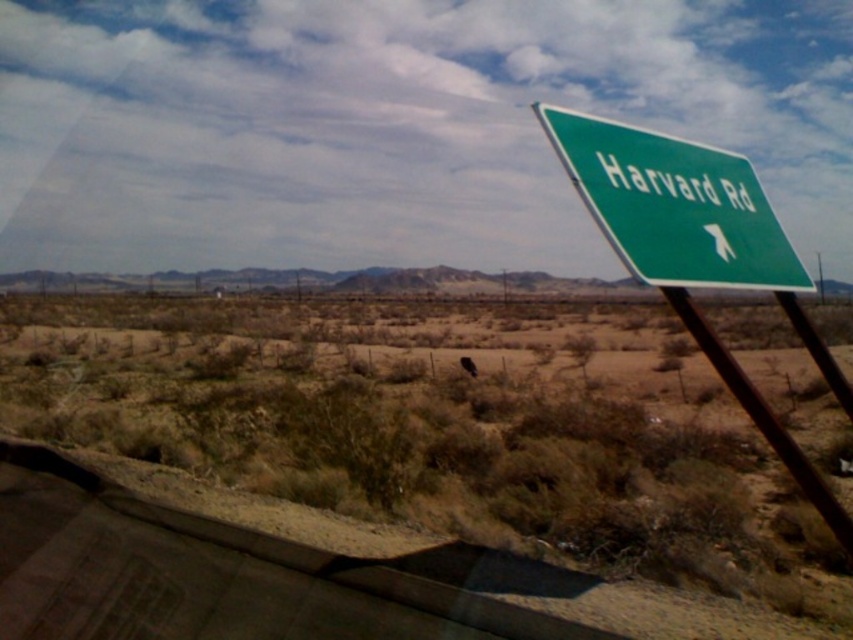
Which is behind, point (804, 337) or point (802, 490)?

Positioned behind is point (804, 337).

Is green plastic street sign at upper right to the right of green metallic pole at upper right from the viewer's perspective?

Yes, green plastic street sign at upper right is to the right of green metallic pole at upper right.

Describe the element at coordinates (698, 252) in the screenshot. I see `green plastic street sign at upper right` at that location.

Image resolution: width=853 pixels, height=640 pixels. Identify the location of green plastic street sign at upper right. (698, 252).

Is green plastic street sign at upper right taller than green glossy sign at upper right?

Indeed, green plastic street sign at upper right has a greater height compared to green glossy sign at upper right.

Between point (798, 312) and point (618, 243), which one is positioned in front?

Point (618, 243) is in front.

The width and height of the screenshot is (853, 640). In order to click on green plastic street sign at upper right in this screenshot , I will do `click(698, 252)`.

This screenshot has width=853, height=640. What do you see at coordinates (674, 205) in the screenshot?
I see `green glossy sign at upper right` at bounding box center [674, 205].

Which is more to the right, green glossy sign at upper right or green metallic pole at upper right?

green metallic pole at upper right is more to the right.

Locate an element on the screen. The height and width of the screenshot is (640, 853). green glossy sign at upper right is located at coordinates (674, 205).